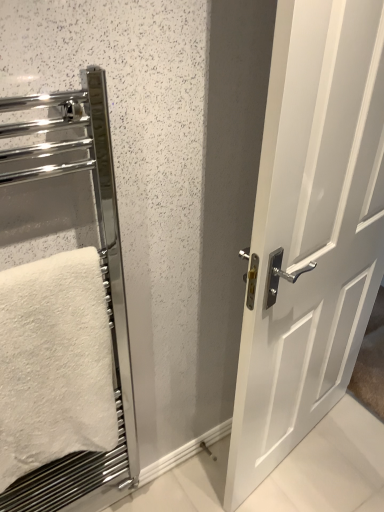
This screenshot has height=512, width=384. I want to click on white fluffy towel at left, so click(x=54, y=362).

Describe the element at coordinates (111, 334) in the screenshot. I see `chrome metallic towel rack at left` at that location.

Measure the distance between point (100,157) and camera.

The depth of point (100,157) is 7.57 feet.

You are a GUI agent. You are given a task and a screenshot of the screen. Output one action in this format:
    pyautogui.click(x=<x>, y=<y>)
    Task: Click on the white fluffy towel at left
    
    Given the screenshot: What is the action you would take?
    pyautogui.click(x=54, y=362)

I want to click on elevator below the white fluffy towel at left (from a real-world perspective), so click(x=111, y=334).

Measure the distance from white fluffy towel at left to chrome metallic towel rack at left.

white fluffy towel at left and chrome metallic towel rack at left are 29.09 centimeters apart from each other.

Looking at their sizes, would you say white fluffy towel at left is wider or thinner than chrome metallic towel rack at left?

Clearly, white fluffy towel at left has more width compared to chrome metallic towel rack at left.

Is chrome metallic towel rack at left a part of white fluffy towel at left?

That's incorrect, chrome metallic towel rack at left is not inside white fluffy towel at left.

Which is correct: chrome metallic towel rack at left is inside white glossy door at center, or outside of it?

chrome metallic towel rack at left cannot be found inside white glossy door at center.

From a real-world perspective, between chrome metallic towel rack at left and white glossy door at center, who is vertically lower?

white glossy door at center.

What's the angular difference between chrome metallic towel rack at left and white glossy door at center's facing directions?

10.7 degrees separate the facing orientations of chrome metallic towel rack at left and white glossy door at center.

Is chrome metallic towel rack at left thinner than white glossy door at center?

Indeed, chrome metallic towel rack at left has a lesser width compared to white glossy door at center.

Can you confirm if chrome metallic towel rack at left is shorter than white fluffy towel at left?

No.

Is chrome metallic towel rack at left placed right next to white fluffy towel at left?

chrome metallic towel rack at left is not next to white fluffy towel at left, and they're not touching.

Is chrome metallic towel rack at left wider or thinner than white fluffy towel at left?

Clearly, chrome metallic towel rack at left has less width compared to white fluffy towel at left.

In the scene shown: Which of these two, chrome metallic towel rack at left or white fluffy towel at left, is smaller?

Smaller between the two is white fluffy towel at left.

How different are the orientations of white fluffy towel at left and white glossy door at center in degrees?

10.7 degrees separate the facing orientations of white fluffy towel at left and white glossy door at center.

Find the location of `towel behind the white glossy door at center`. towel behind the white glossy door at center is located at coordinates click(x=54, y=362).

Are white fluffy towel at left and white glossy door at center far apart?

No.

Based on the photo, from a real-world perspective, which is physically below, white fluffy towel at left or white glossy door at center?

white glossy door at center is physically lower.

Measure the distance between white glossy door at center and chrome metallic towel rack at left.

white glossy door at center and chrome metallic towel rack at left are 23.32 inches apart from each other.

From a real-world perspective, is white glossy door at center positioned over chrome metallic towel rack at left based on gravity?

No, from a real-world perspective, white glossy door at center is not on top of chrome metallic towel rack at left.

Does white glossy door at center have a greater width compared to chrome metallic towel rack at left?

Correct, the width of white glossy door at center exceeds that of chrome metallic towel rack at left.

Between white glossy door at center and chrome metallic towel rack at left, which one is positioned in front?

chrome metallic towel rack at left is in front.

Is white glossy door at center facing away from white fluffy towel at left?

No, white glossy door at center is not facing away from white fluffy towel at left.

In order to click on door that appears above the white fluffy towel at left (from the image's perspective) in this screenshot , I will do `click(310, 230)`.

Is white glossy door at center not inside white fluffy towel at left?

white glossy door at center is positioned outside white fluffy towel at left.

Which object is wider, white glossy door at center or white fluffy towel at left?

white fluffy towel at left.

Find the location of `towel behind the chrome metallic towel rack at left`. towel behind the chrome metallic towel rack at left is located at coordinates (54, 362).

The width and height of the screenshot is (384, 512). Find the location of `door on the right side of chrome metallic towel rack at left`. door on the right side of chrome metallic towel rack at left is located at coordinates (310, 230).

Based on their spatial positions, is chrome metallic towel rack at left or white glossy door at center further from white fluffy towel at left?

white glossy door at center.

When comparing their distances from white fluffy towel at left, does white glossy door at center or chrome metallic towel rack at left seem closer?

Result: Among the two, chrome metallic towel rack at left is located nearer to white fluffy towel at left.

When comparing their distances from white glossy door at center, does chrome metallic towel rack at left or white fluffy towel at left seem further?

chrome metallic towel rack at left is further to white glossy door at center.

Estimate the real-world distances between objects in this image. Which object is closer to chrome metallic towel rack at left, white fluffy towel at left or white glossy door at center?

Based on the image, white fluffy towel at left appears to be nearer to chrome metallic towel rack at left.

Based on the photo, based on their spatial positions, is white fluffy towel at left or chrome metallic towel rack at left further from white glossy door at center?

The object further to white glossy door at center is chrome metallic towel rack at left.

Estimate the real-world distances between objects in this image. Which object is closer to chrome metallic towel rack at left, white glossy door at center or white fluffy towel at left?

white fluffy towel at left is positioned closer to the anchor chrome metallic towel rack at left.

Where is `towel between chrome metallic towel rack at left and white glossy door at center from left to right`? towel between chrome metallic towel rack at left and white glossy door at center from left to right is located at coordinates (54, 362).